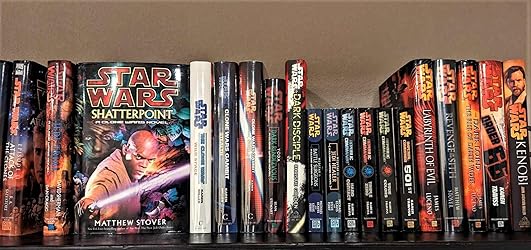
Find the location of a particular element. white book is located at coordinates (196, 87).